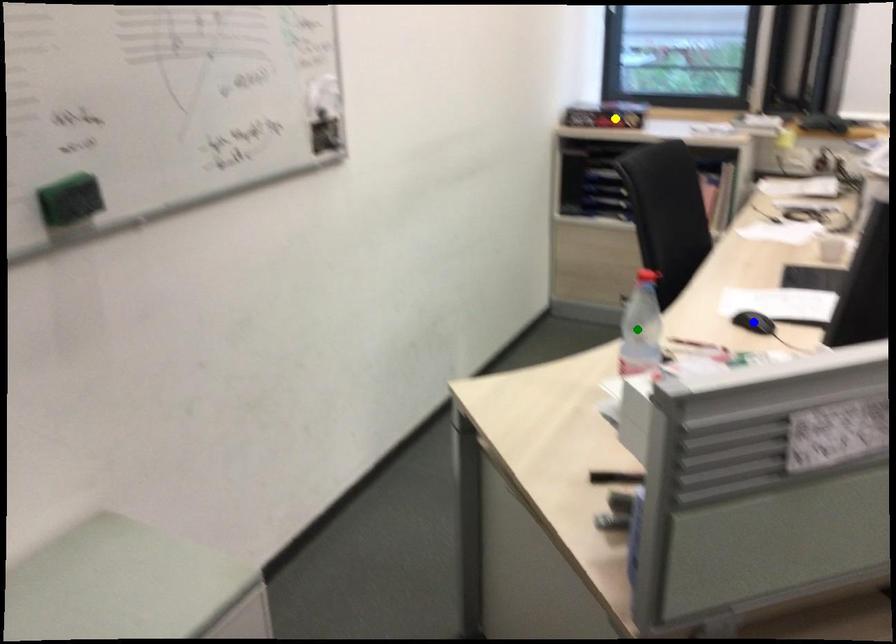
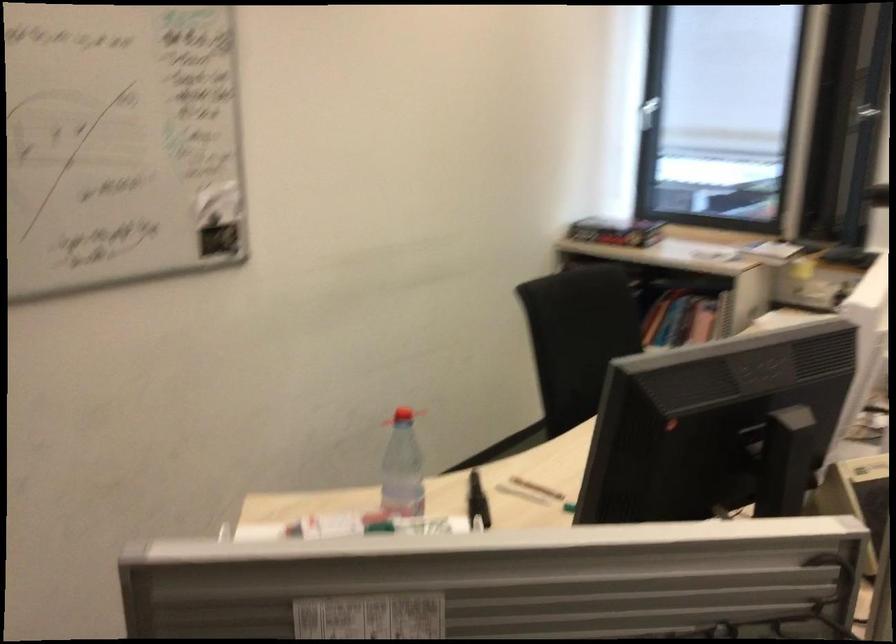
I am providing you with two images of the same scene from different viewpoints. Three points are marked in image1. Which point corresponds to a part or object that is occluded in image2?In image1, three points are marked. Which of them correspond to a part or object that is occluded in image2?Among the three points shown in image1, which one corresponds to a part or object that is no longer visible due to occlusion in image2?

Invisible in image2: blue point.